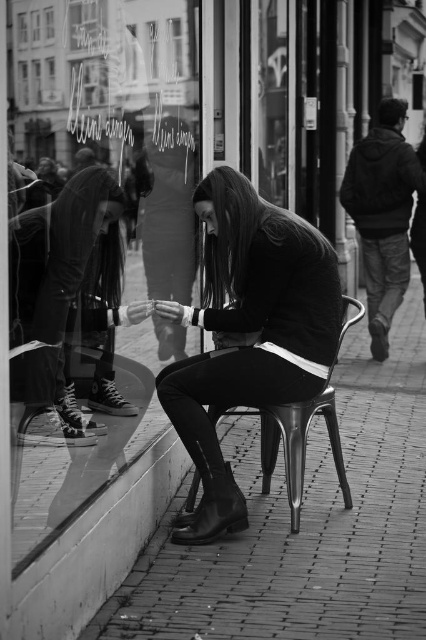
The width and height of the screenshot is (426, 640). I want to click on metallic pavement at lower center, so click(307, 524).

Find the location of a particular element. metallic pavement at lower center is located at coordinates (307, 524).

Where is `metallic pavement at lower center`? This screenshot has height=640, width=426. metallic pavement at lower center is located at coordinates (307, 524).

Locate an element on the screen. The height and width of the screenshot is (640, 426). metallic pavement at lower center is located at coordinates (307, 524).

Is metallic pavement at lower center below matte black sweater at center?

Indeed, metallic pavement at lower center is positioned under matte black sweater at center.

This screenshot has height=640, width=426. What do you see at coordinates (307, 524) in the screenshot? I see `metallic pavement at lower center` at bounding box center [307, 524].

Find the location of a particular element. metallic pavement at lower center is located at coordinates (307, 524).

Does matte black sweater at center appear on the left side of transparent glass at upper left?

Incorrect, matte black sweater at center is not on the left side of transparent glass at upper left.

Describe the element at coordinates (247, 332) in the screenshot. I see `matte black sweater at center` at that location.

Locate an element on the screen. matte black sweater at center is located at coordinates pyautogui.click(x=247, y=332).